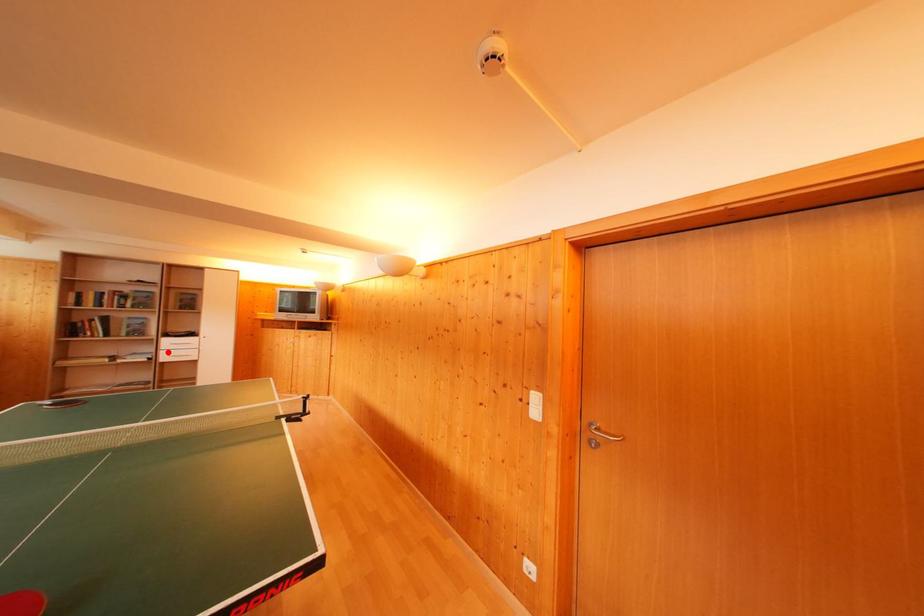
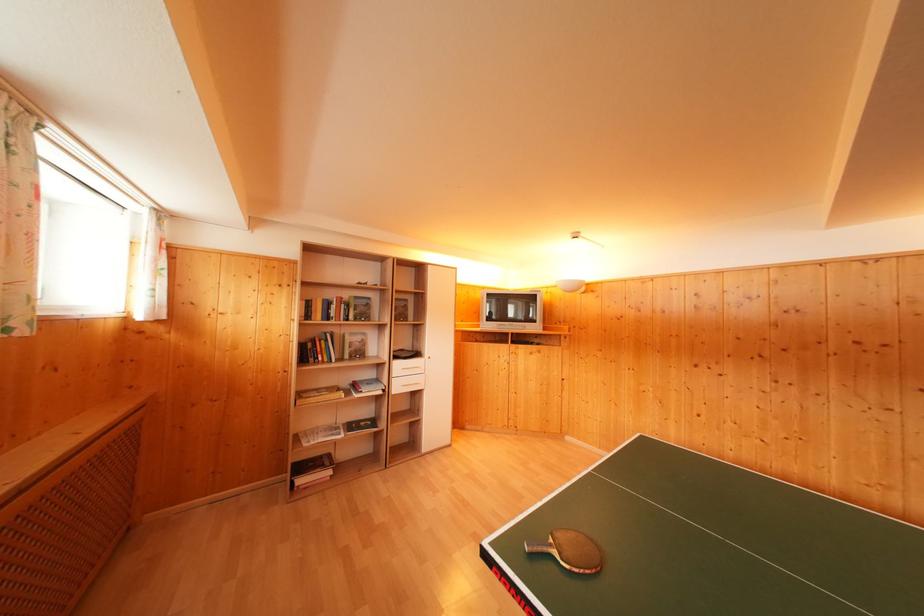
In the second image, find the point that corresponds to the highlighted location in the first image.

(398, 379)